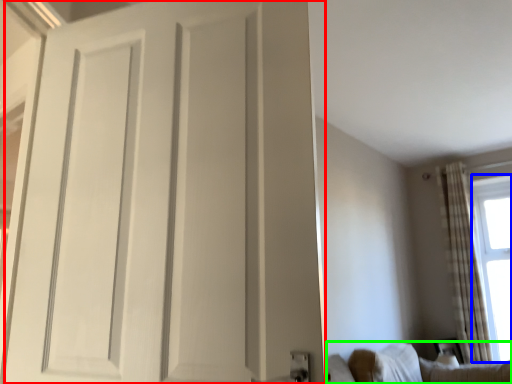
Question: Which object is positioned farthest from door (highlighted by a red box)? Select from window screen (highlighted by a blue box) and furniture (highlighted by a green box).

Choices:
 (A) window screen
 (B) furniture

Answer: (A)